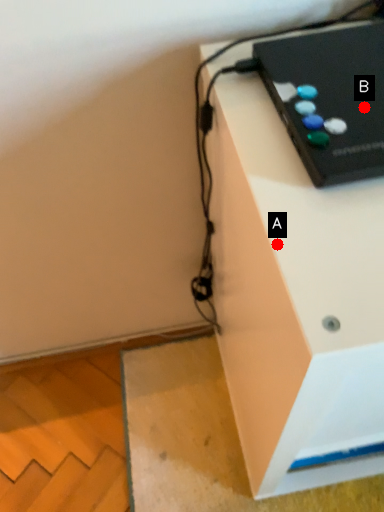
Question: Two points are circled on the image, labeled by A and B beside each circle. Which point is farther to the camera?

Choices:
 (A) A is further
 (B) B is further

Answer: (B)